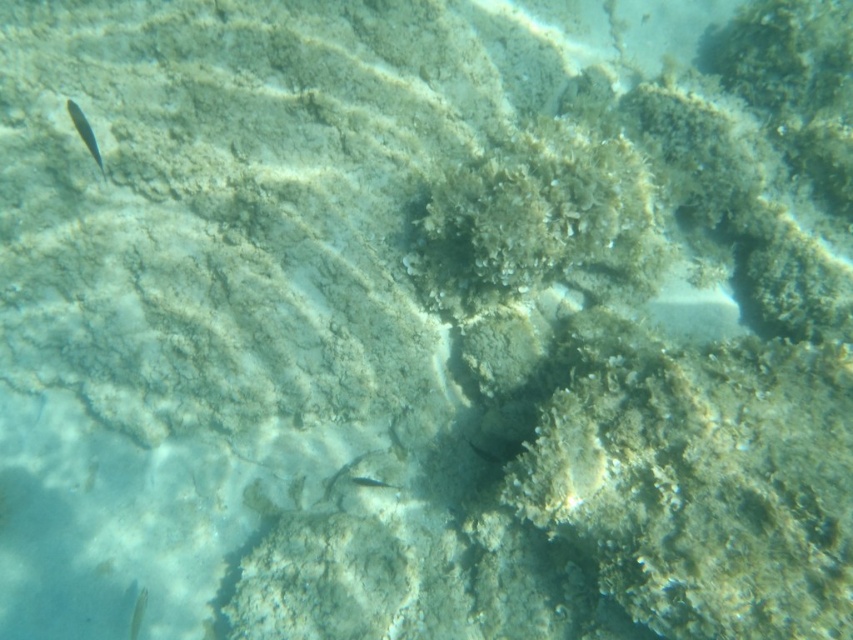
Based on the photo, you are a marine biologist observing underwater life. You notice a green translucent fish at upper left and a translucent clear fish at lower left. Which fish is positioned to the right of the other?

The green translucent fish at upper left is positioned to the right of the translucent clear fish at lower left.

You are a marine biologist observing an underwater scene. You notice a green translucent fish at upper left. If you want to locate it precisely on a coordinate system where the bottom left corner is the origin, what are its coordinates?

The green translucent fish at upper left is located at coordinates point [84,132].

You are a marine biologist observing an underwater scene. You notice a green translucent fish at upper left and a translucent clear fish at lower left. Which fish has a greater width?

The green translucent fish at upper left has a greater width than the translucent clear fish at lower left.